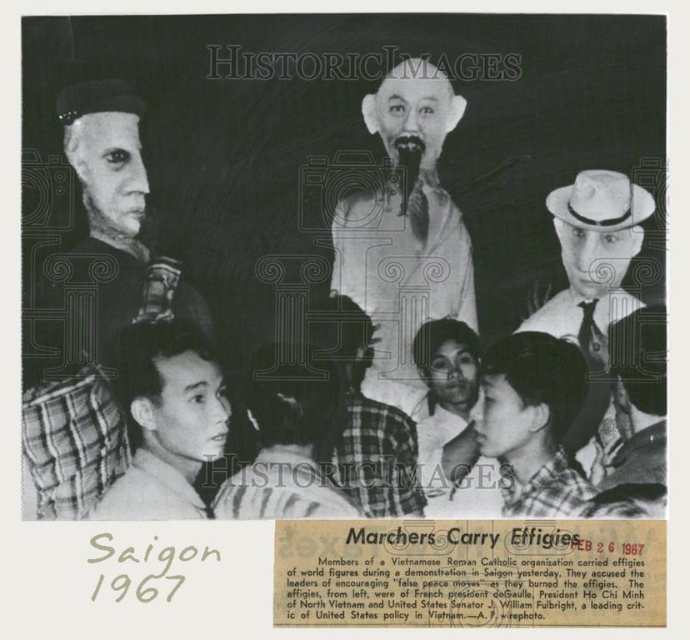
Based on the scene description, which plaid shirt is larger in size between the plaid shirt at lower left and the plaid shirt at center?

The plaid shirt at lower left is bigger than the plaid shirt at center.

Based on the scene described, which object occupies a larger portion of the image between the smooth white statue at upper center and the plaid shirt at center?

The smooth white statue at upper center is bigger than the plaid shirt at center, so it occupies a larger portion of the image.